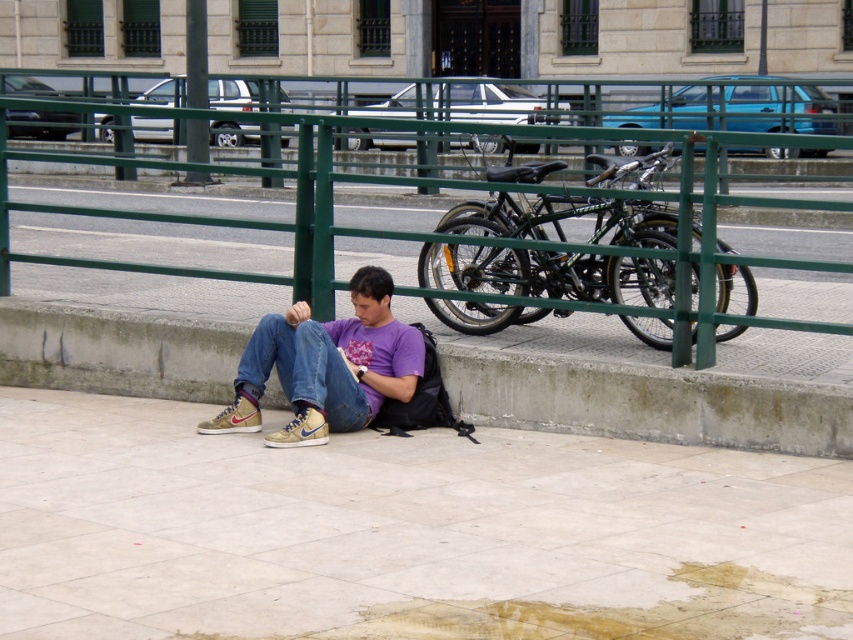
You are a delivery person who needs to place a package on the shiny black bicycle at center. The package is 1.5 feet wide. Can you fit the package on the bicycle without it overlapping the matte purple shirt at center?

The shiny black bicycle at center is 3.62 feet away from the matte purple shirt at center. Since the package is 1.5 feet wide, there is enough space between them to place the package on the bicycle without overlapping the shirt.

You are a delivery robot navigating the urban scene. Your current position is at point 0.628, 0.760. You need to reach the concrete at lower left. Is your current position the same as the target location?

Yes, the concrete at lower left is located at point (x=647, y=401), so your current position matches the target location.

You are a delivery person who needs to place a package on the ground near the man sitting on the concrete ledge. The package is 1 meter long. You have two options for placing it either on the smooth concrete pavement at lower center or the concrete at lower left. Which location allows the package to be placed entirely within the visible area of the concrete without overhanging?

The smooth concrete pavement at lower center is closer to the viewer than the concrete at lower left. Since the package is 1 meter long, placing it on the smooth concrete pavement at lower center, which is closer, would ensure it fits entirely within the visible area as it occupies less depth compared to the concrete at lower left.